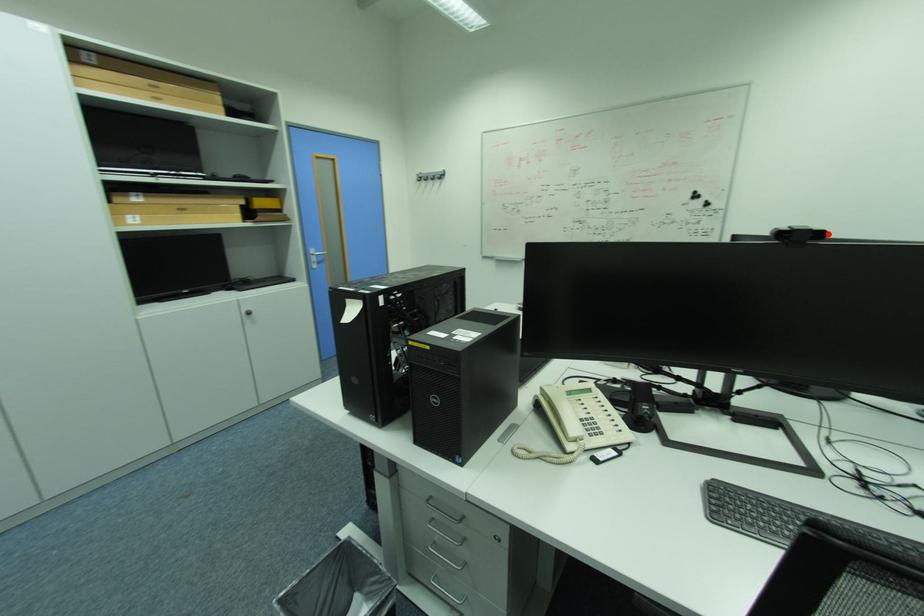
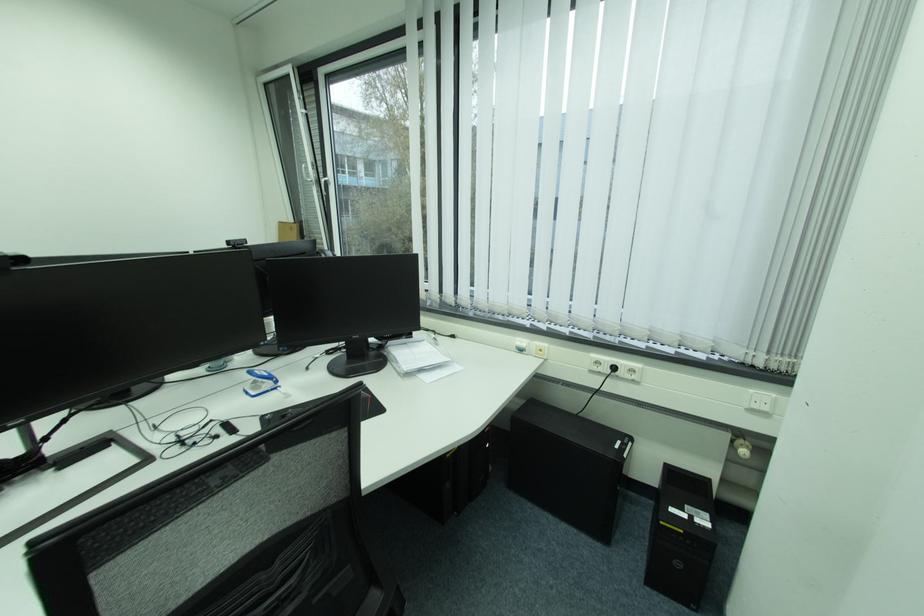
The point at the highlighted location is marked in the first image. Where is the corresponding point in the second image?

(29, 261)